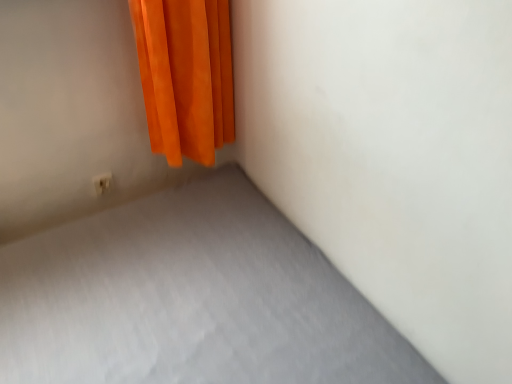
In order to click on gray matte sheet at lower center in this screenshot , I will do `click(190, 299)`.

What do you see at coordinates (190, 299) in the screenshot? This screenshot has height=384, width=512. I see `gray matte sheet at lower center` at bounding box center [190, 299].

You are a GUI agent. You are given a task and a screenshot of the screen. Output one action in this format:
    pyautogui.click(x=<x>, y=<y>)
    Task: Click on the gray matte sheet at lower center
    This screenshot has width=512, height=384.
    Given the screenshot: What is the action you would take?
    pyautogui.click(x=190, y=299)